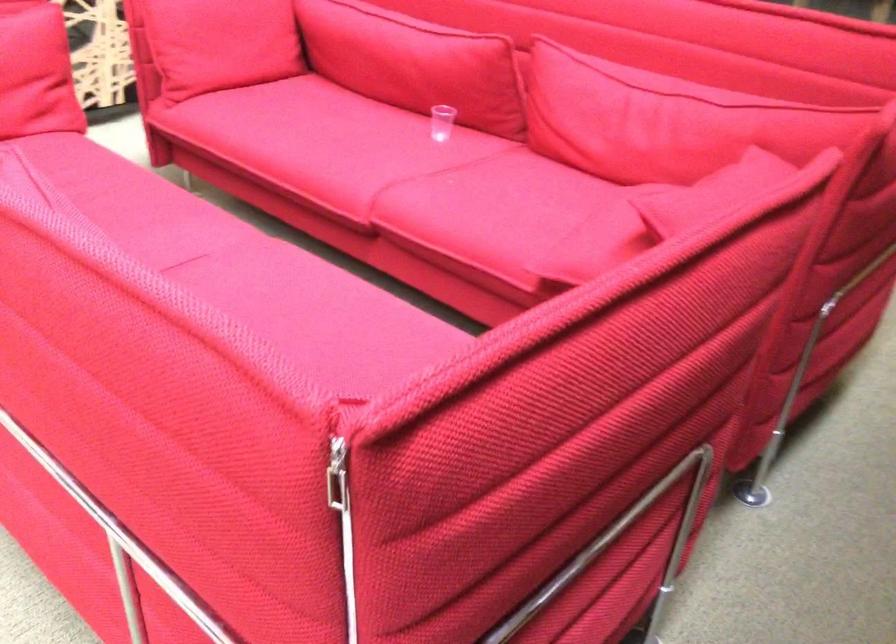
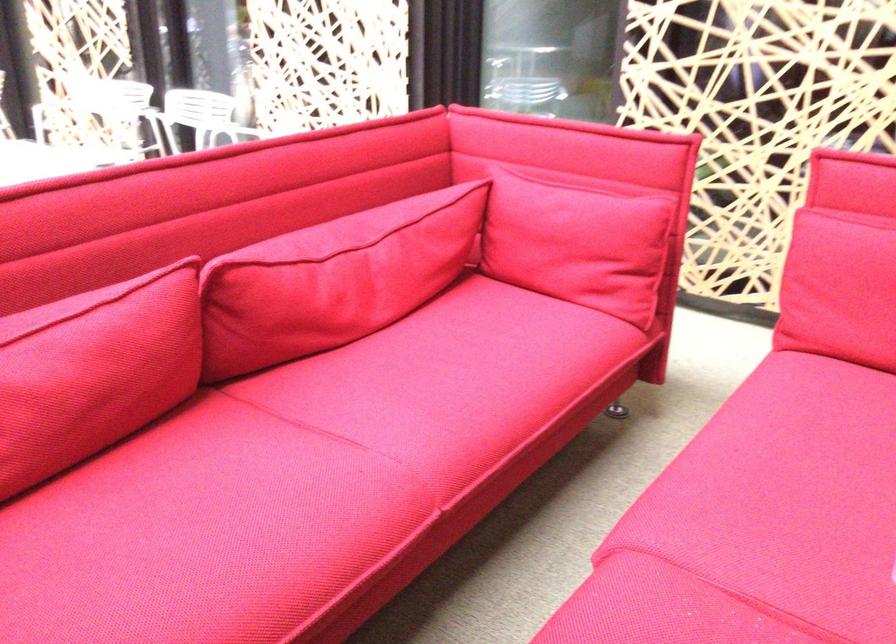
Find the pixel in the second image that matches point 399,155 in the first image.

(759, 522)